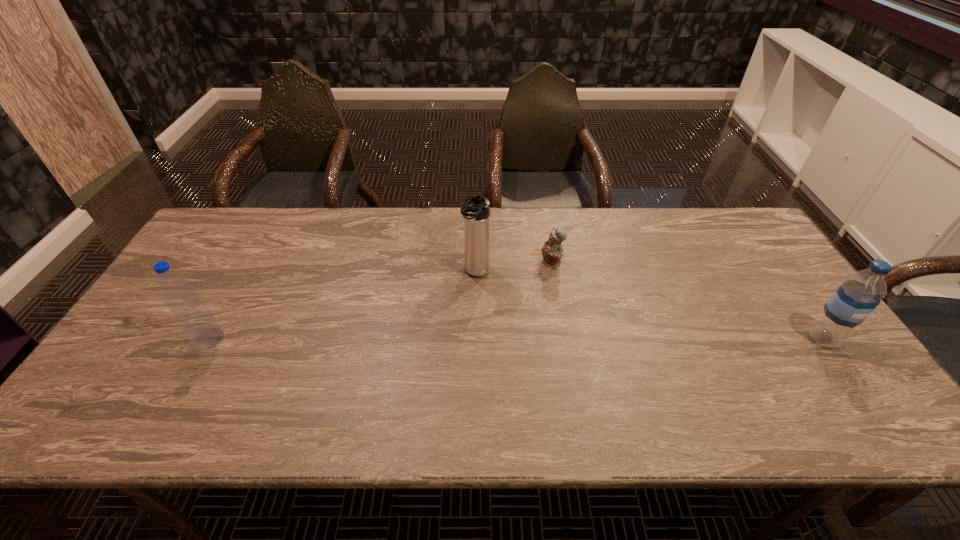
Image resolution: width=960 pixels, height=540 pixels. In order to click on free space at the near left corner of the desktop in this screenshot , I will do `click(148, 369)`.

I want to click on vacant position at the far right corner of the desktop, so click(719, 242).

This screenshot has width=960, height=540. Identify the location of empty space that is in between the shortest object and the thermos bottle. (514, 268).

The image size is (960, 540). Identify the location of free spot between the teddy bear and the thermos bottle. (514, 268).

Find the location of `free space between the teddy bear and the second object from left to right`. free space between the teddy bear and the second object from left to right is located at coordinates (514, 268).

Find the location of `vacant space in between the left water bottle and the thermos bottle`. vacant space in between the left water bottle and the thermos bottle is located at coordinates (343, 306).

At what (x,y) coordinates should I click in order to perform the action: click on free space that is in between the rightmost object and the leftmost object. Please return your answer as a coordinate pair (x, y). Image resolution: width=960 pixels, height=540 pixels. Looking at the image, I should click on (516, 339).

The width and height of the screenshot is (960, 540). I want to click on vacant area that lies between the left water bottle and the right water bottle, so click(x=516, y=339).

Identify the location of unoccupied position between the second object from left to right and the rightmost object. The width and height of the screenshot is (960, 540). (650, 306).

This screenshot has height=540, width=960. What are the coordinates of `vacant space that's between the rightmost object and the third object from right to left` in the screenshot? It's located at (650, 306).